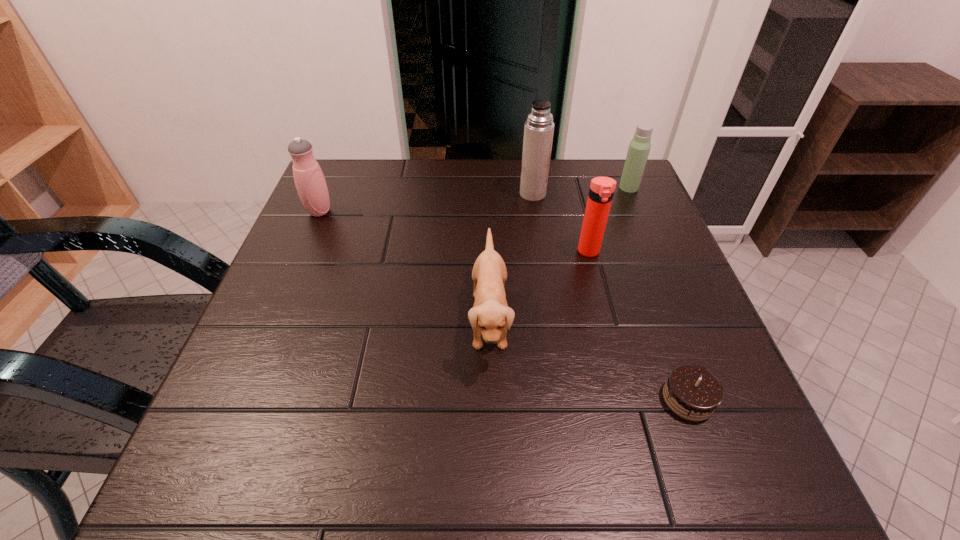
Identify the location of free space located 0.220m on the front of the third thermos bottle from right to left. The height and width of the screenshot is (540, 960). (542, 261).

The width and height of the screenshot is (960, 540). In order to click on vacant region located 0.360m on the right of the second nearest thermos bottle in this screenshot , I will do `click(481, 211)`.

You are a GUI agent. You are given a task and a screenshot of the screen. Output one action in this format:
    pyautogui.click(x=<x>, y=<y>)
    Task: Click on the blank area located on the right of the fourth object from left to right
    The height and width of the screenshot is (540, 960).
    Given the screenshot: What is the action you would take?
    pyautogui.click(x=668, y=252)

What are the coordinates of `vacant space located on the left of the rightmost thermos bottle` in the screenshot? It's located at (469, 187).

This screenshot has height=540, width=960. What are the coordinates of `blank space located on the left side of the fifth tallest object` in the screenshot? It's located at (269, 320).

In order to click on free space located 0.170m on the left side of the fifth tallest object in this screenshot , I will do `click(380, 320)`.

Find the location of a particular element. This screenshot has width=960, height=540. vacant position located 0.280m on the left side of the fifth tallest object is located at coordinates (322, 320).

Find the location of a particular element. free space located on the left of the chocolate cake is located at coordinates (620, 399).

This screenshot has width=960, height=540. Identify the location of object present at the left edge. (309, 179).

This screenshot has height=540, width=960. Find the location of `chocolate cake that is at the right edge`. chocolate cake that is at the right edge is located at coordinates (692, 392).